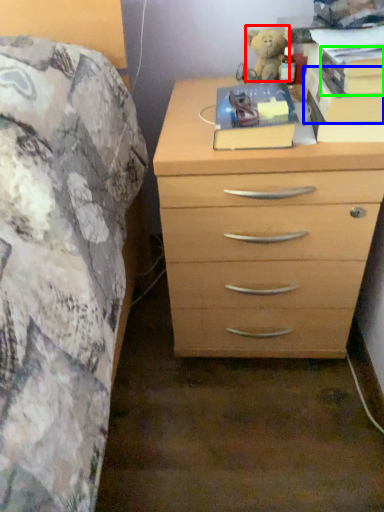
Question: Estimate the real-world distances between objects in this image. Which object is closer to teddy (highlighted by a red box), paperback book (highlighted by a blue box) or paperback book (highlighted by a green box)?

Choices:
 (A) paperback book
 (B) paperback book

Answer: (A)